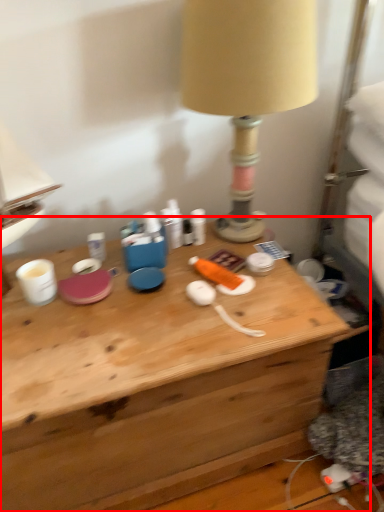
Question: From the image's perspective, considering the relative positions of desk (annotated by the red box) and lamp in the image provided, where is desk (annotated by the red box) located with respect to the staircase?

Choices:
 (A) below
 (B) above

Answer: (A)